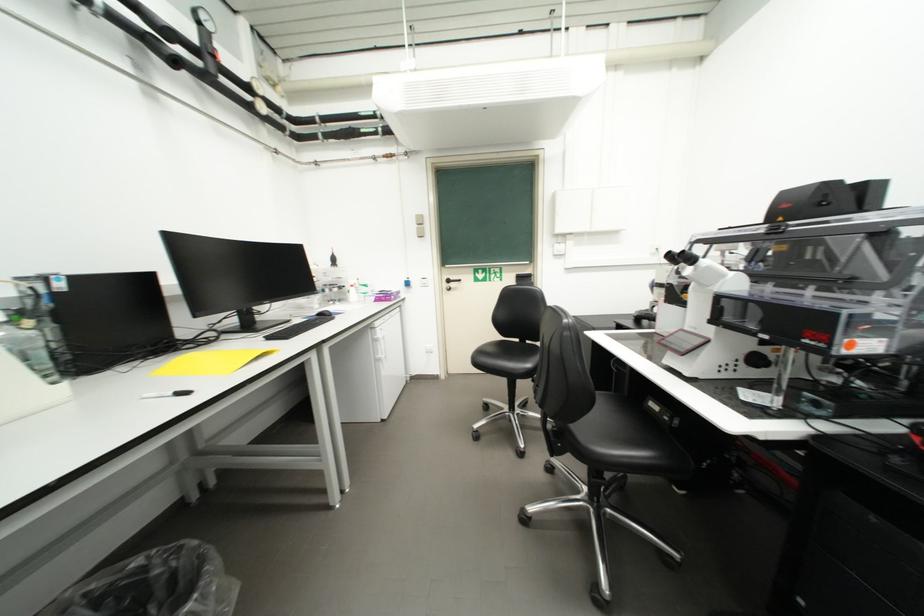
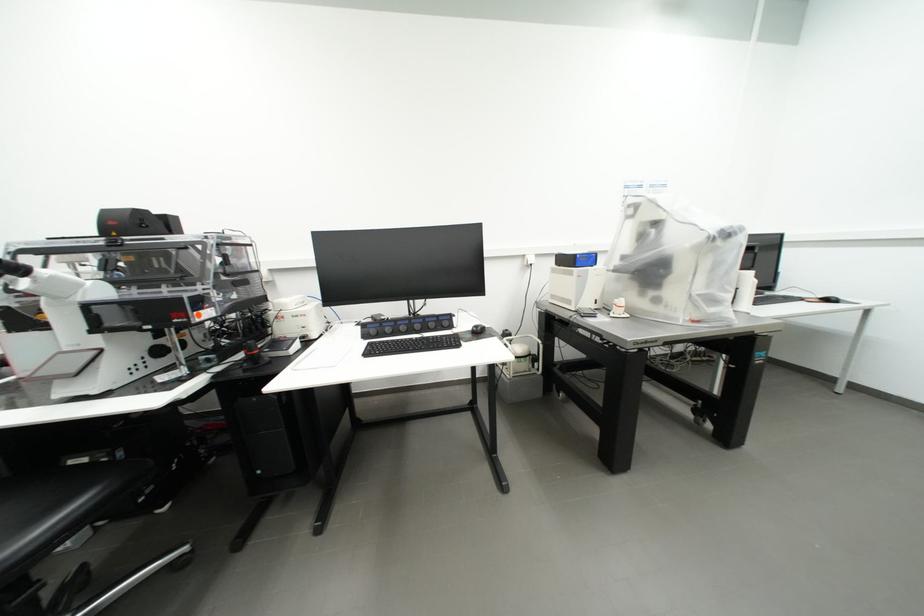
Question: The camera is either moving clockwise (left) or counter-clockwise (right) around the object. The first image is from the beginning of the video and the second image is from the end. Is the camera moving left or right when shooting the video?

Choices:
 (A) Left
 (B) Right

Answer: (A)